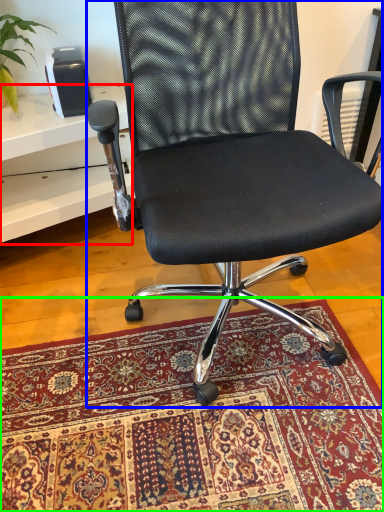
Question: Which object is the farthest from table (highlighted by a red box)? Choose among these: chair (highlighted by a blue box) or mat (highlighted by a green box).

Choices:
 (A) chair
 (B) mat

Answer: (B)